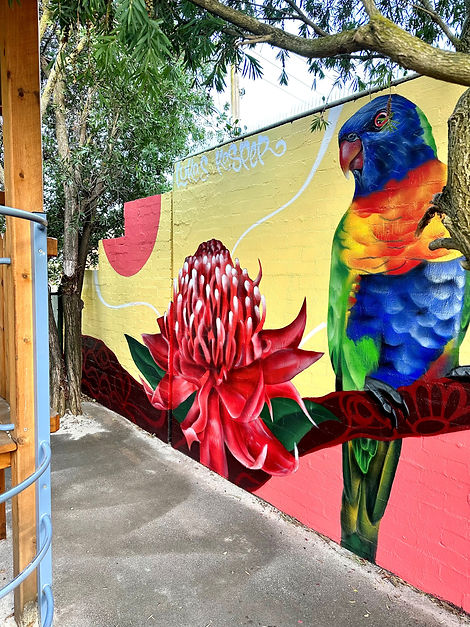
Find the location of `mural painting of red flower`. mural painting of red flower is located at coordinates (233, 348).